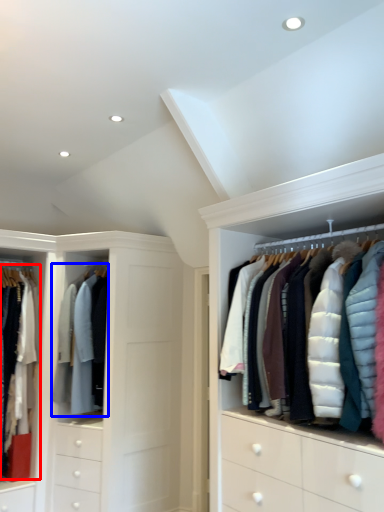
Question: Which object appears farthest to the camera in this image, clothing (highlighted by a red box) or clothing (highlighted by a blue box)?

Choices:
 (A) clothing
 (B) clothing

Answer: (B)